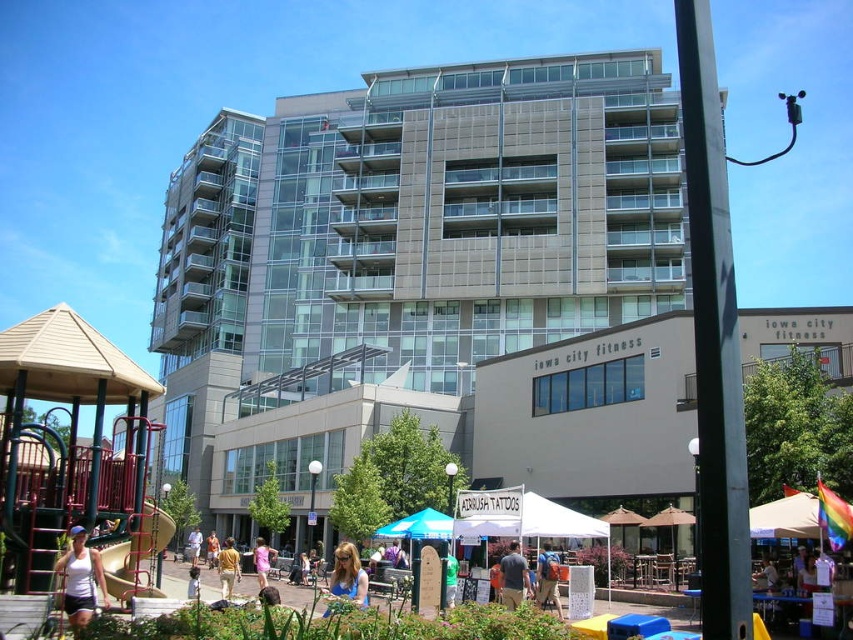
Question: Which of the following is the closest to the observer?

Choices:
 (A) (213, 532)
 (B) (94, 572)
 (C) (447, 582)

Answer: (B)

Question: Which point appears closest to the camera in this image?

Choices:
 (A) (213, 557)
 (B) (258, 573)
 (C) (556, 564)

Answer: (C)

Question: Does pink fabric dress at center have a lesser width compared to light brown wooden skateboard at center?

Choices:
 (A) yes
 (B) no

Answer: (B)

Question: Which object is the closest to the orange cotton shirt at center?

Choices:
 (A) light brown wooden skateboard at center
 (B) tan cotton shirt at center
 (C) blonde hair at center
 (D) pink fabric dress at center

Answer: (A)

Question: Does pink fabric dress at center come behind green t-shirt at center?

Choices:
 (A) no
 (B) yes

Answer: (B)

Question: Can you confirm if blue denim jeans at center is wider than tan cotton shirt at center?

Choices:
 (A) yes
 (B) no

Answer: (B)